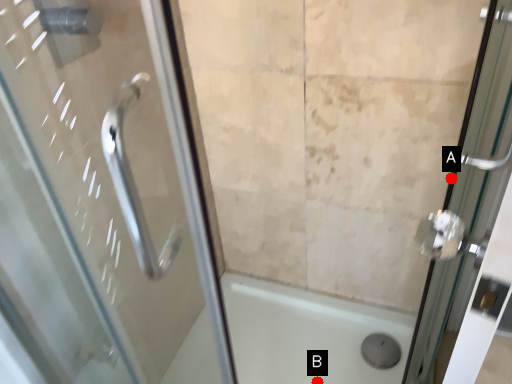
Question: Two points are circled on the image, labeled by A and B beside each circle. Among these points, which one is nearest to the camera?

Choices:
 (A) A is closer
 (B) B is closer

Answer: (A)